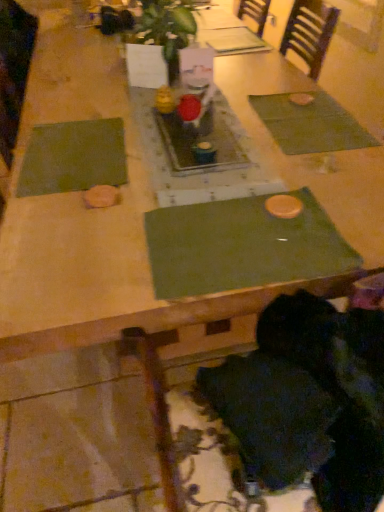
Identify the location of vacant space underneath green fabric placemat at upper right, which is counted as the first place mat, starting from the right (from a real-world perspective). (312, 120).